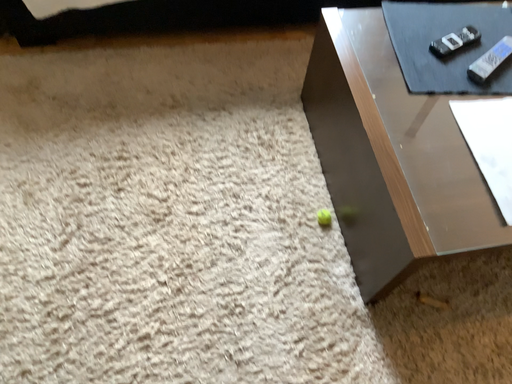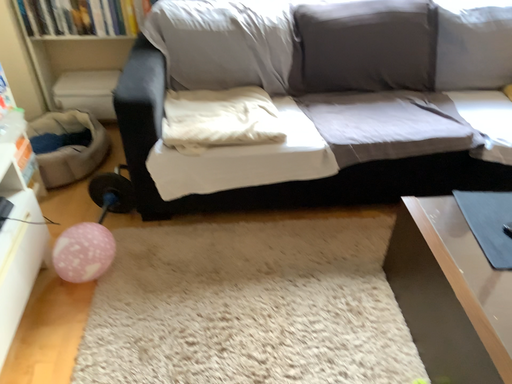
Question: How did the camera likely rotate when shooting the video?

Choices:
 (A) rotated upward
 (B) rotated downward

Answer: (A)